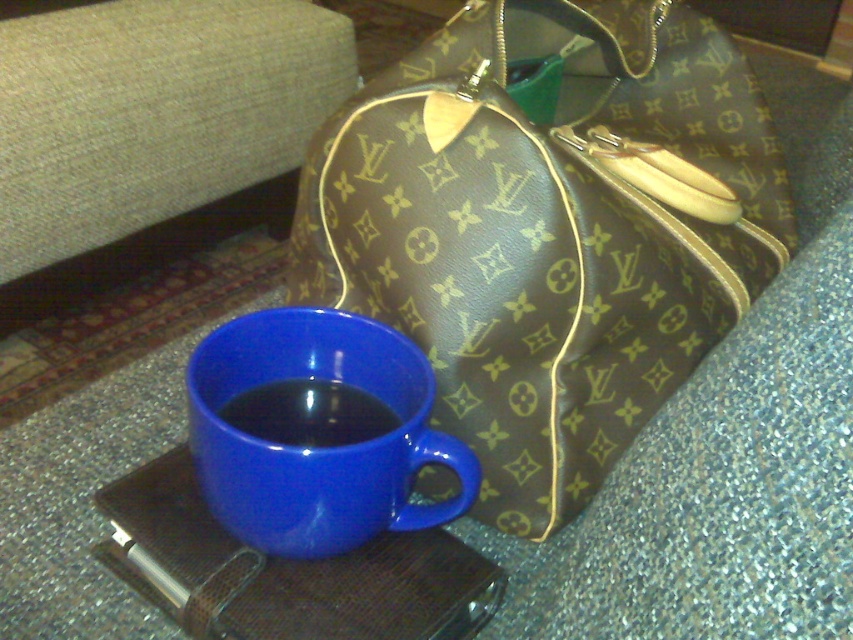
Question: Which of the following is the farthest from the observer?

Choices:
 (A) (247, 332)
 (B) (325, 113)
 (C) (701, 104)

Answer: (B)

Question: Where is brown monogrammed bag at center located in relation to matte blue cup at center in the image?

Choices:
 (A) right
 (B) left

Answer: (A)

Question: Does brown monogrammed bag at center appear under beige fabric couch at upper left?

Choices:
 (A) yes
 (B) no

Answer: (A)

Question: Among these objects, which one is farthest from the camera?

Choices:
 (A) matte blue cup at center
 (B) brown monogrammed bag at center

Answer: (A)

Question: Is beige fabric couch at upper left to the left of matte blue cup at center from the viewer's perspective?

Choices:
 (A) no
 (B) yes

Answer: (B)

Question: Which point is closer to the camera?

Choices:
 (A) (490, 436)
 (B) (277, 538)
 (C) (305, 444)
 (D) (231, 179)

Answer: (B)